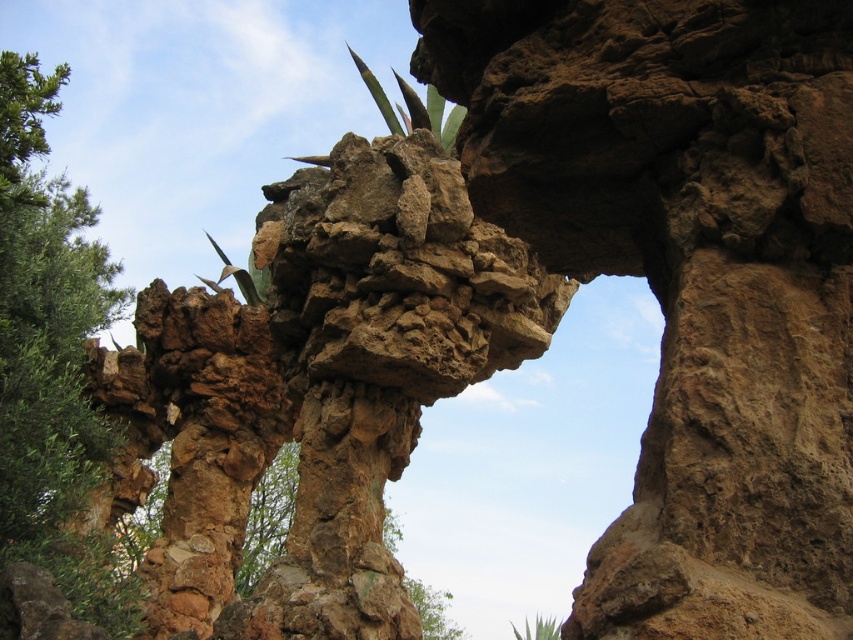
You are standing at the center of the archway in the rock formation. Looking towards the green leafy tree at left, which direction should you face to see it? Please answer with either left, right, forward, or backward.

You should face left to see the green leafy tree at left since it is positioned at the left side of the archway.

You are standing in front of the rock formation and want to take a photo. There are two points marked on the rock formation at coordinates point (x=32, y=262) and point (x=537, y=625). Which point will appear closer to the camera in your photo?

Point (x=32, y=262) is closer to the camera than point (x=537, y=625), so it will appear closer in the photo.

Which of the following objects is wider? The green leafy tree at left or the green leafy plant at lower center?

The green leafy tree at left is wider than the green leafy plant at lower center according to the description.